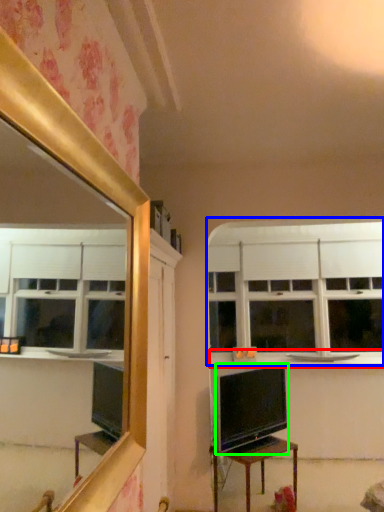
Question: Which is farther away from counter top (highlighted by a red box)? window (highlighted by a blue box) or television (highlighted by a green box)?

Choices:
 (A) window
 (B) television

Answer: (B)